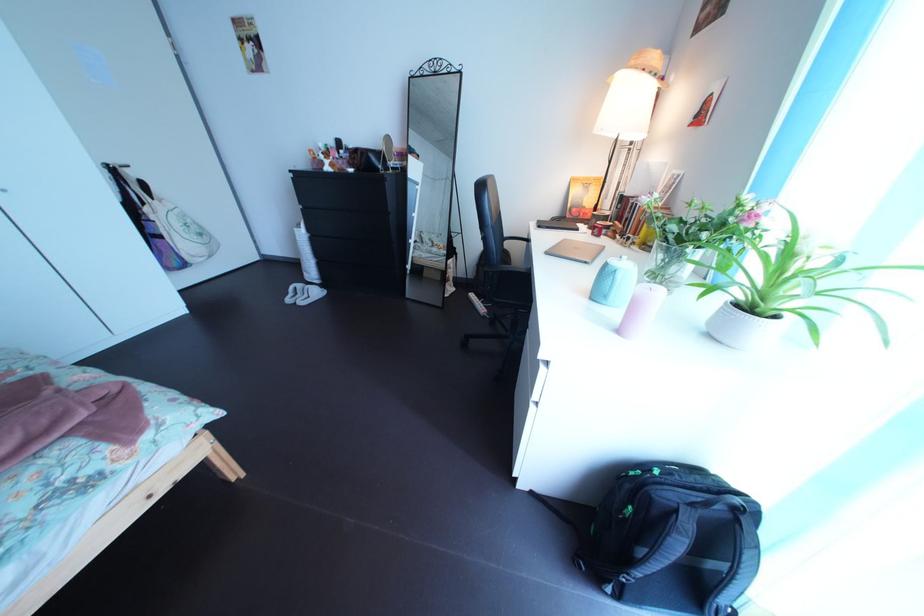
Identify the location of blue lidded jar. (614, 282).